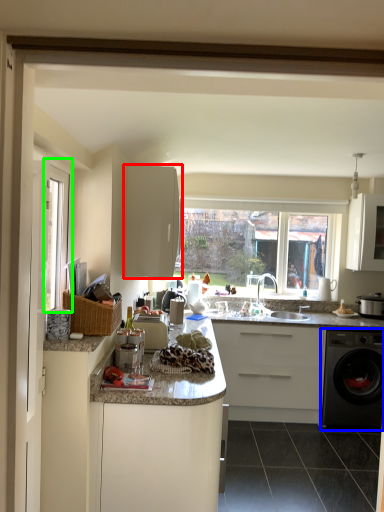
Question: Estimate the real-world distances between objects in this image. Which object is farther from cabinetry (highlighted by a red box), washing machine (highlighted by a blue box) or window frame (highlighted by a green box)?

Choices:
 (A) washing machine
 (B) window frame

Answer: (A)